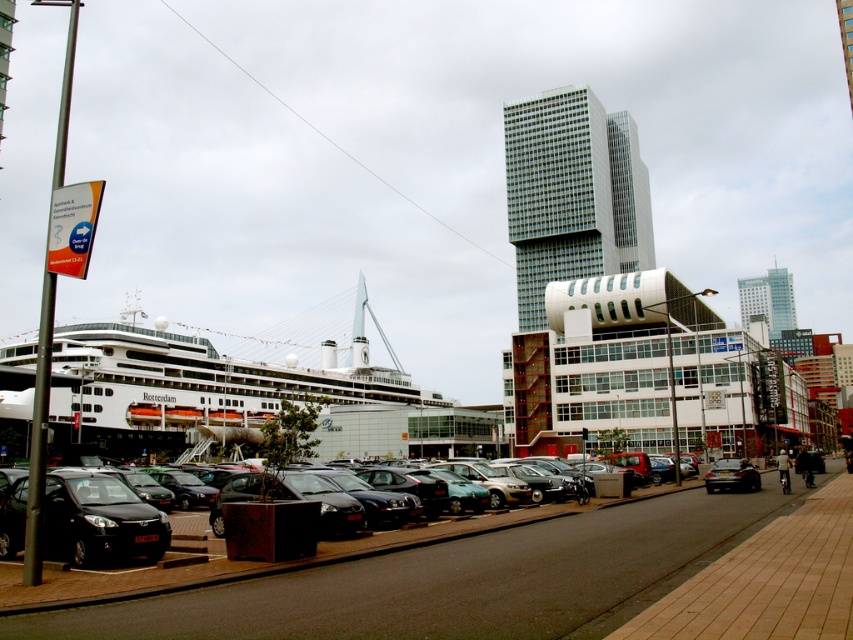
You are standing at the point marked by the coordinates point (196, 387) in the image. What object are you currently standing on?

You are standing on the white glossy cruise ship at lower left.

You are standing at the point labeled point (44, 525) and want to walk towards the point labeled point (604, 632). Which direction should you face to move towards it?

You should face towards the upper right direction to move from point (44, 525) towards point (604, 632) since it is located in that direction relative to your current position.